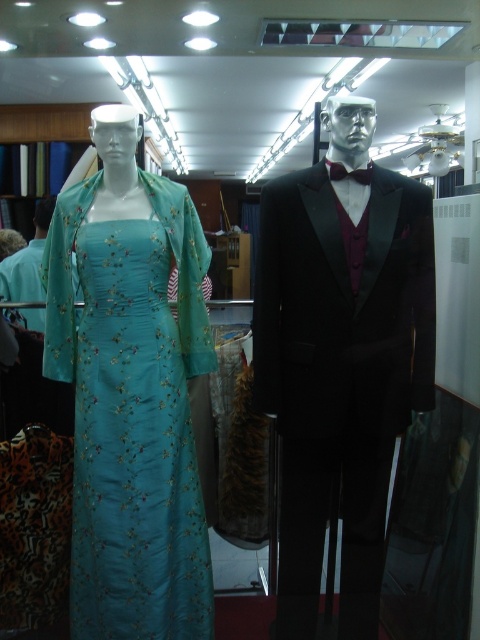
Question: Which point appears farthest from the camera in this image?

Choices:
 (A) (324, 208)
 (B) (351, 176)
 (C) (191, 612)

Answer: (C)

Question: Which of the following is the closest to the observer?

Choices:
 (A) shiny black suit at center
 (B) dark purple satin bow tie at center

Answer: (A)

Question: Can you confirm if shiny black suit at center is bigger than teal silk dress at left?

Choices:
 (A) yes
 (B) no

Answer: (A)

Question: Can you confirm if shiny black suit at center is wider than dark purple satin bow tie at center?

Choices:
 (A) yes
 (B) no

Answer: (A)

Question: Is shiny black suit at center further to the viewer compared to dark purple satin bow tie at center?

Choices:
 (A) no
 (B) yes

Answer: (A)

Question: Which point is farther to the camera?

Choices:
 (A) shiny black suit at center
 (B) dark purple satin bow tie at center

Answer: (B)